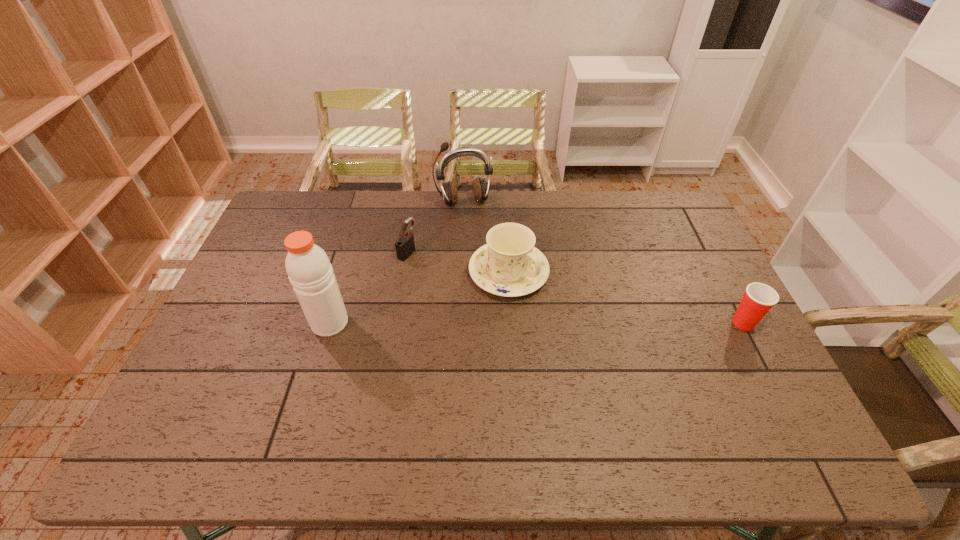
The image size is (960, 540). In order to click on the tallest object in this screenshot , I will do `click(308, 267)`.

Where is `the leftmost object`? the leftmost object is located at coordinates (308, 267).

The width and height of the screenshot is (960, 540). Find the location of `the rightmost object`. the rightmost object is located at coordinates (759, 298).

Where is `padlock`? This screenshot has height=540, width=960. padlock is located at coordinates (405, 246).

Image resolution: width=960 pixels, height=540 pixels. What are the coordinates of `the farthest object` in the screenshot? It's located at coord(480,189).

At what (x,y) coordinates should I click in order to perform the action: click on the second tallest object. Please return your answer as a coordinate pair (x, y). The width and height of the screenshot is (960, 540). Looking at the image, I should click on (480, 189).

Locate an element on the screen. This screenshot has height=540, width=960. chinaware is located at coordinates (509, 265).

The height and width of the screenshot is (540, 960). In order to click on vacant region located 0.090m on the front of the shaker in this screenshot , I will do `click(317, 366)`.

The width and height of the screenshot is (960, 540). What are the coordinates of `free space located on the left of the rightmost object` in the screenshot? It's located at (604, 323).

Identify the location of vacant area located with the keyhole on the front of the padlock. The width and height of the screenshot is (960, 540). (x=462, y=276).